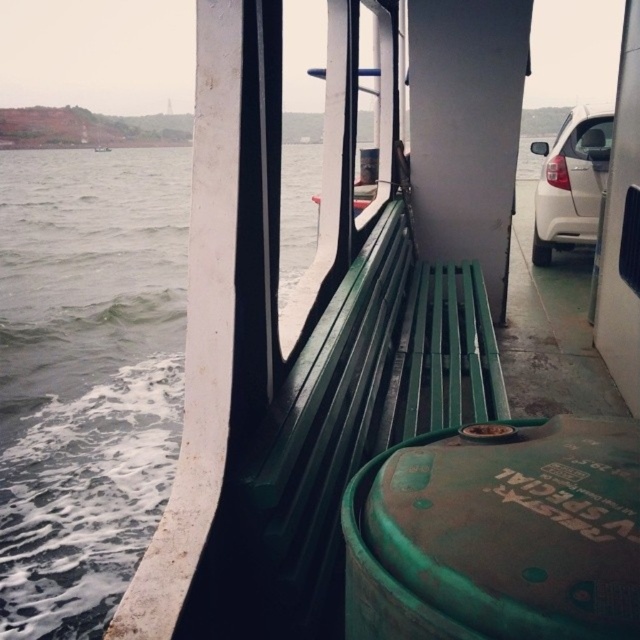
Question: Which object is the farthest from the green matte barrel at lower center?

Choices:
 (A) green matte water at left
 (B) green painted wood bench at center
 (C) white matte car at right

Answer: (C)

Question: Does green matte barrel at lower center have a greater width compared to green painted wood bench at center?

Choices:
 (A) no
 (B) yes

Answer: (A)

Question: Estimate the real-world distances between objects in this image. Which object is farther from the green painted wood bench at center?

Choices:
 (A) green matte water at left
 (B) green matte barrel at lower center

Answer: (A)

Question: Among these objects, which one is farthest from the camera?

Choices:
 (A) green painted wood bench at center
 (B) green matte water at left
 (C) white matte car at right

Answer: (C)

Question: Is green matte water at left thinner than white matte car at right?

Choices:
 (A) yes
 (B) no

Answer: (B)

Question: Can you confirm if green painted wood bench at center is smaller than white matte car at right?

Choices:
 (A) no
 (B) yes

Answer: (A)